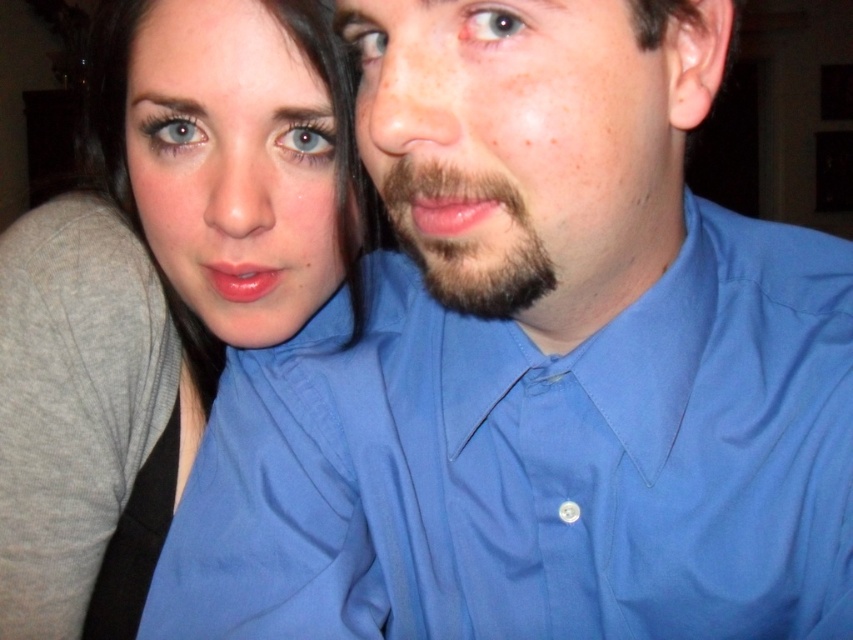
Question: Does blue smooth shirt at center come behind dark brown fuzzy beard at center?

Choices:
 (A) yes
 (B) no

Answer: (A)

Question: Which of the following is the closest to the observer?

Choices:
 (A) (467, 204)
 (B) (685, 404)

Answer: (A)

Question: Among these points, which one is farthest from the camera?

Choices:
 (A) (316, 348)
 (B) (515, 262)
 (C) (177, 12)

Answer: (C)

Question: Which point is farther from the camera taking this photo?

Choices:
 (A) (39, 381)
 (B) (430, 282)
 (C) (637, 390)

Answer: (A)

Question: Can you confirm if blue smooth shirt at center is positioned above dark brown fuzzy beard at center?

Choices:
 (A) no
 (B) yes

Answer: (A)

Question: Is blue smooth shirt at center positioned at the back of dark brown fuzzy beard at center?

Choices:
 (A) no
 (B) yes

Answer: (B)